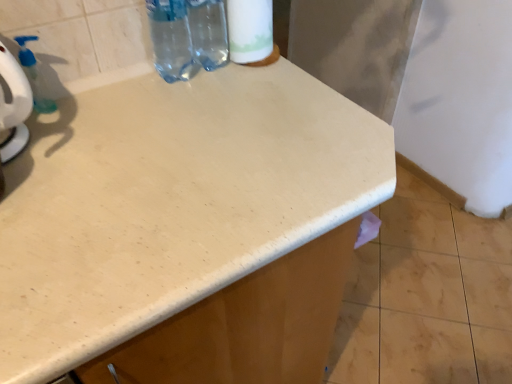
Locate an element on the screen. The image size is (512, 384). free space on the front side of transparent plastic soap dispenser at upper left is located at coordinates (49, 150).